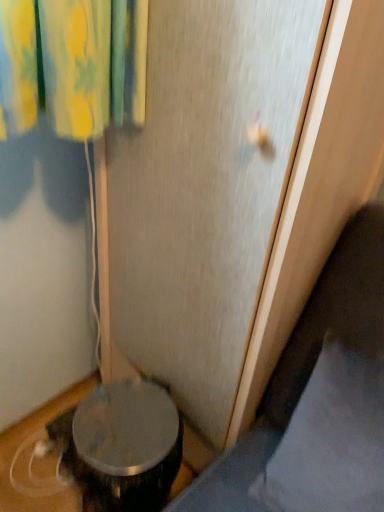
This screenshot has height=512, width=384. Describe the element at coordinates (202, 194) in the screenshot. I see `transparent plastic screen door at center` at that location.

Find the location of `transparent plastic screen door at center`. transparent plastic screen door at center is located at coordinates (202, 194).

What is the approximate height of transparent plastic screen door at center?

transparent plastic screen door at center is 1.28 meters in height.

This screenshot has height=512, width=384. What do you see at coordinates (331, 439) in the screenshot? I see `gray fabric pillow at lower right` at bounding box center [331, 439].

The image size is (384, 512). Identify the location of gray fabric pillow at lower right. (331, 439).

Locate an element on the screen. transparent plastic screen door at center is located at coordinates (202, 194).

Considering the relative positions of gray fabric pillow at lower right and transparent plastic screen door at center in the image provided, is gray fabric pillow at lower right to the left or to the right of transparent plastic screen door at center?

From the image, it's evident that gray fabric pillow at lower right is to the right of transparent plastic screen door at center.

Is gray fabric pillow at lower right behind transparent plastic screen door at center?

Yes, gray fabric pillow at lower right is behind transparent plastic screen door at center.

Which is farther, (325, 385) or (155, 231)?

The point (155, 231) is behind.

From the image's perspective, is gray fabric pillow at lower right above or below transparent plastic screen door at center?

Based on their image positions, gray fabric pillow at lower right is located beneath transparent plastic screen door at center.

From a real-world perspective, is gray fabric pillow at lower right positioned above or below transparent plastic screen door at center?

From a real-world perspective, gray fabric pillow at lower right is physically below transparent plastic screen door at center.

Looking at this image, considering the sizes of gray fabric pillow at lower right and transparent plastic screen door at center in the image, is gray fabric pillow at lower right wider or thinner than transparent plastic screen door at center?

In the image, gray fabric pillow at lower right appears to be more narrow than transparent plastic screen door at center.

From their relative heights in the image, would you say gray fabric pillow at lower right is taller or shorter than transparent plastic screen door at center?

gray fabric pillow at lower right is shorter than transparent plastic screen door at center.

Which of these two, gray fabric pillow at lower right or transparent plastic screen door at center, is smaller?

Smaller between the two is gray fabric pillow at lower right.

Do you think gray fabric pillow at lower right is within transparent plastic screen door at center, or outside of it?

gray fabric pillow at lower right cannot be found inside transparent plastic screen door at center.

Consider the image. Are gray fabric pillow at lower right and transparent plastic screen door at center making contact?

gray fabric pillow at lower right is not next to transparent plastic screen door at center, and they're not touching.

Is gray fabric pillow at lower right facing away from transparent plastic screen door at center?

No, gray fabric pillow at lower right's orientation is not away from transparent plastic screen door at center.

Where is `pillow below the transparent plastic screen door at center (from a real-world perspective)`? The height and width of the screenshot is (512, 384). pillow below the transparent plastic screen door at center (from a real-world perspective) is located at coordinates (331, 439).

Between transparent plastic screen door at center and gray fabric pillow at lower right, which one appears on the right side from the viewer's perspective?

Positioned to the right is gray fabric pillow at lower right.

Between transparent plastic screen door at center and gray fabric pillow at lower right, which one is positioned behind?

gray fabric pillow at lower right.

Considering the positions of points (196, 193) and (369, 437), is point (196, 193) farther from camera compared to point (369, 437)?

That is True.

From the image's perspective, would you say transparent plastic screen door at center is shown under gray fabric pillow at lower right?

Incorrect, from the image's perspective, transparent plastic screen door at center is higher than gray fabric pillow at lower right.

From a real-world perspective, between transparent plastic screen door at center and gray fabric pillow at lower right, who is vertically higher?

transparent plastic screen door at center, from a real-world perspective.

Which object is thinner, transparent plastic screen door at center or gray fabric pillow at lower right?

Thinner between the two is gray fabric pillow at lower right.

Considering the sizes of transparent plastic screen door at center and gray fabric pillow at lower right in the image, is transparent plastic screen door at center taller or shorter than gray fabric pillow at lower right?

Clearly, transparent plastic screen door at center is taller compared to gray fabric pillow at lower right.

Does transparent plastic screen door at center have a larger size compared to gray fabric pillow at lower right?

Yes.

Is gray fabric pillow at lower right located within transparent plastic screen door at center?

A: Actually, gray fabric pillow at lower right is outside transparent plastic screen door at center.

Is transparent plastic screen door at center next to gray fabric pillow at lower right and touching it?

No, transparent plastic screen door at center is not making contact with gray fabric pillow at lower right.

Could you tell me if transparent plastic screen door at center is facing gray fabric pillow at lower right?

No, transparent plastic screen door at center is not turned towards gray fabric pillow at lower right.

Can you tell me how much transparent plastic screen door at center and gray fabric pillow at lower right differ in facing direction?

The facing directions of transparent plastic screen door at center and gray fabric pillow at lower right are 0.000421 degrees apart.

Where is `screen door that appears above the gray fabric pillow at lower right (from the image's perspective)`? Image resolution: width=384 pixels, height=512 pixels. screen door that appears above the gray fabric pillow at lower right (from the image's perspective) is located at coordinates (202, 194).

Locate an element on the screen. This screenshot has width=384, height=512. screen door above the gray fabric pillow at lower right (from the image's perspective) is located at coordinates (202, 194).

I want to click on pillow below the transparent plastic screen door at center (from the image's perspective), so click(x=331, y=439).